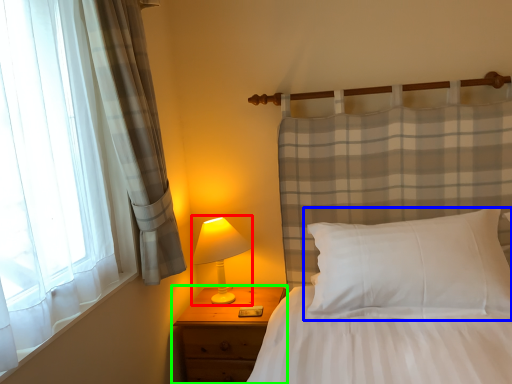
Question: Based on their relative distances, which object is farther from table lamp (highlighted by a red box)? Choose from pillow (highlighted by a blue box) and nightstand (highlighted by a green box).

Choices:
 (A) pillow
 (B) nightstand

Answer: (A)